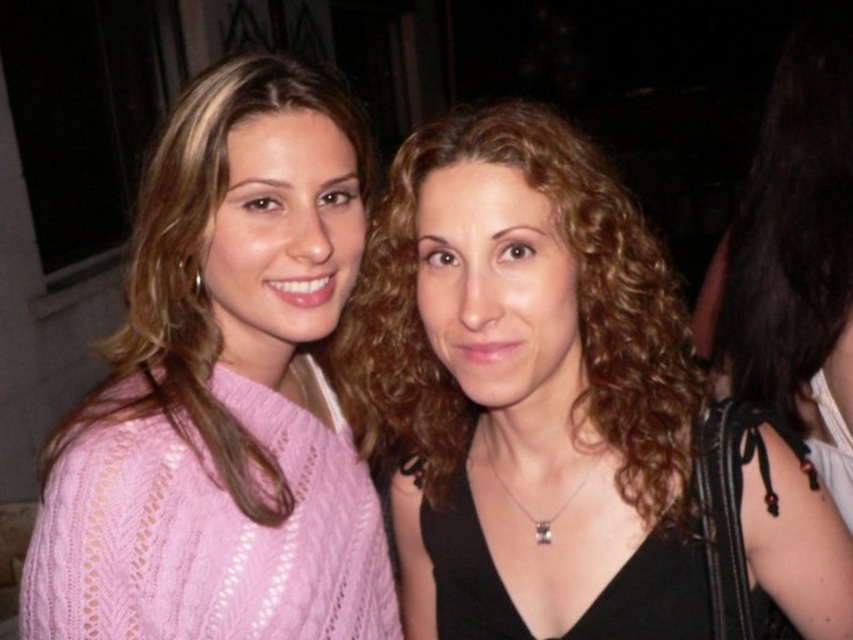
You are a photographer setting up for a group photo. You notice two people in the frame wearing the matte black top at center and the pink knitted sweater at center. Which clothing item is located to the right of the other?

The matte black top at center is positioned on the right side of the pink knitted sweater at center.

You are a fashion designer who needs to create a new collection that emphasizes contrasting sizes. You observe two garments in the image, the matte black top at center and the pink knitted sweater at center. Which garment should you choose if you want to highlight a larger size in your design?

The matte black top at center has a larger size compared to the pink knitted sweater at center, so you should choose the matte black top at center to highlight a larger size in your design.